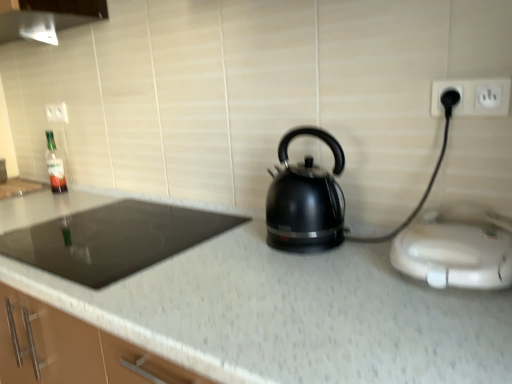
The height and width of the screenshot is (384, 512). In order to click on free space in front of white plastic toaster at right in this screenshot , I will do `click(447, 332)`.